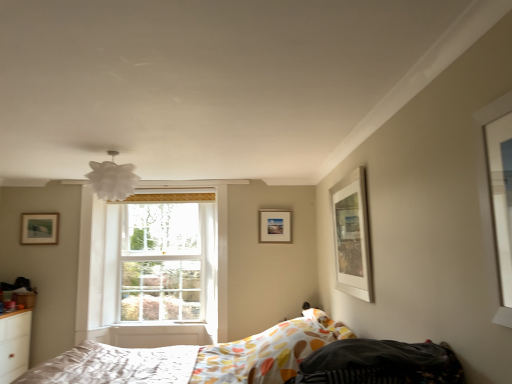
Locate an element on the screen. The image size is (512, 384). patterned fabric mattress at lower right, the second mattress from the bottom is located at coordinates (380, 363).

Where is `white matte picture frame at upper right, marked as the third picture frame in a left-to-right arrangement`? The image size is (512, 384). white matte picture frame at upper right, marked as the third picture frame in a left-to-right arrangement is located at coordinates (352, 236).

Image resolution: width=512 pixels, height=384 pixels. What do you see at coordinates (196, 358) in the screenshot? I see `patterned fabric bed at lower center` at bounding box center [196, 358].

Locate an element on the screen. patterned fabric mattress at lower right, marked as the first mattress in a right-to-left arrangement is located at coordinates (380, 363).

I want to click on the 1st picture frame above the white matte picture frame at upper right, marked as the third picture frame in a left-to-right arrangement (from a real-world perspective), so click(275, 226).

What's the angular difference between wooden picture frame at center, arranged as the 1th picture frame when viewed from the back, and white matte picture frame at upper right, arranged as the 1th picture frame when viewed from the right,'s facing directions?

The angular difference between wooden picture frame at center, arranged as the 1th picture frame when viewed from the back, and white matte picture frame at upper right, arranged as the 1th picture frame when viewed from the right, is 89.8 degrees.

In the scene shown: Considering the sizes of objects wooden picture frame at center, the second picture frame in the right-to-left sequence, and white matte picture frame at upper right, which is counted as the 1th picture frame, starting from the front, in the image provided, who is taller, wooden picture frame at center, the second picture frame in the right-to-left sequence, or white matte picture frame at upper right, which is counted as the 1th picture frame, starting from the front,?

With more height is white matte picture frame at upper right, which is counted as the 1th picture frame, starting from the front.

Would you say patterned fabric mattress at lower right, which is the second mattress from back to front, is part of wooden picture frame at upper left, the 1th picture frame when ordered from left to right,'s contents?

No, wooden picture frame at upper left, the 1th picture frame when ordered from left to right, does not contain patterned fabric mattress at lower right, which is the second mattress from back to front.

In the scene shown: Is wooden picture frame at upper left, marked as the 2th picture frame in a back-to-front arrangement, next to patterned fabric mattress at lower right, marked as the first mattress in a right-to-left arrangement, and touching it?

No, wooden picture frame at upper left, marked as the 2th picture frame in a back-to-front arrangement, is not with patterned fabric mattress at lower right, marked as the first mattress in a right-to-left arrangement.

Considering the positions of objects wooden picture frame at upper left, the 1th picture frame when ordered from left to right, and patterned fabric mattress at lower right, the second mattress from the bottom, in the image provided, who is more to the right, wooden picture frame at upper left, the 1th picture frame when ordered from left to right, or patterned fabric mattress at lower right, the second mattress from the bottom,?

patterned fabric mattress at lower right, the second mattress from the bottom.

What's the angular difference between wooden picture frame at upper left, marked as the 2th picture frame in a back-to-front arrangement, and patterned fabric mattress at lower right, which is the first mattress in top-to-bottom order,'s facing directions?

89.1 degrees separate the facing orientations of wooden picture frame at upper left, marked as the 2th picture frame in a back-to-front arrangement, and patterned fabric mattress at lower right, which is the first mattress in top-to-bottom order.

Is patterned fabric mattress at lower right, marked as the first mattress in a right-to-left arrangement, bigger than patterned fabric bed at lower center?

No.

How far apart are patterned fabric mattress at lower right, which is counted as the first mattress, starting from the front, and patterned fabric bed at lower center?

patterned fabric mattress at lower right, which is counted as the first mattress, starting from the front, and patterned fabric bed at lower center are 4.52 feet apart.

How different are the orientations of patterned fabric mattress at lower right, which is the first mattress in top-to-bottom order, and patterned fabric bed at lower center in degrees?

0.000103 degrees separate the facing orientations of patterned fabric mattress at lower right, which is the first mattress in top-to-bottom order, and patterned fabric bed at lower center.

Is patterned fabric mattress at lower right, which is counted as the first mattress, starting from the front, aimed at patterned fabric bed at lower center?

No, patterned fabric mattress at lower right, which is counted as the first mattress, starting from the front, is not facing towards patterned fabric bed at lower center.

Can you tell me how much patterned fabric bed at lower center and white matte picture frame at upper right, arranged as the 1th picture frame when viewed from the right, differ in facing direction?

There is a 0.714-degree angle between the facing directions of patterned fabric bed at lower center and white matte picture frame at upper right, arranged as the 1th picture frame when viewed from the right.

From the picture: Is patterned fabric bed at lower center in front of white matte picture frame at upper right, which appears as the 3th picture frame when viewed from the back?

That is True.

Can you confirm if patterned fabric bed at lower center is smaller than white matte picture frame at upper right, which appears as the 3th picture frame when viewed from the back?

No.

From the image's perspective, which is below, patterned fabric bed at lower center or wooden picture frame at upper left, arranged as the 2th picture frame when viewed from the front?

patterned fabric bed at lower center appears lower in the image.

Is patterned fabric bed at lower center far away from wooden picture frame at upper left, arranged as the 2th picture frame when viewed from the front?

Yes.

From a real-world perspective, between patterned fabric bed at lower center and wooden picture frame at upper left, which is the 3th picture frame in right-to-left order, who is vertically higher?

wooden picture frame at upper left, which is the 3th picture frame in right-to-left order, is physically above.

In the scene shown: Is patterned fabric bed at lower center oriented towards wooden picture frame at upper left, arranged as the 2th picture frame when viewed from the front?

No, patterned fabric bed at lower center is not facing towards wooden picture frame at upper left, arranged as the 2th picture frame when viewed from the front.

Is wooden picture frame at center, the second picture frame in the right-to-left sequence, with patterned fabric bed at lower center?

wooden picture frame at center, the second picture frame in the right-to-left sequence, is not next to patterned fabric bed at lower center, and they're not touching.

Is point (280, 217) more distant than point (153, 375)?

Yes, point (280, 217) is farther from viewer.

Is wooden picture frame at center, the second picture frame in the right-to-left sequence, to the left of patterned fabric bed at lower center from the viewer's perspective?

No.

Between wooden picture frame at center, arranged as the 1th picture frame when viewed from the back, and patterned fabric bed at lower center, which one is positioned in front?

Positioned in front is patterned fabric bed at lower center.

Which point is more distant from viewer, [89,176] or [393,347]?

Point [89,176]

Which of these two, white paper lampshade at upper center or patterned fabric mattress at lower right, marked as the first mattress in a right-to-left arrangement, is thinner?

With smaller width is white paper lampshade at upper center.

Is white paper lampshade at upper center positioned far away from patterned fabric mattress at lower right, which is the second mattress from back to front?

Yes, white paper lampshade at upper center and patterned fabric mattress at lower right, which is the second mattress from back to front, are quite far apart.

Is white paper lampshade at upper center turned away from patterned fabric mattress at lower right, marked as the first mattress in a right-to-left arrangement?

white paper lampshade at upper center is not turned away from patterned fabric mattress at lower right, marked as the first mattress in a right-to-left arrangement.

From a real-world perspective, which picture frame is the 1st one above the white matte picture frame at upper right, which appears as the 3th picture frame when viewed from the back? Please provide its 2D coordinates.

[(275, 226)]

Starting from the patterned fabric mattress at lower right, marked as the first mattress in a right-to-left arrangement, which picture frame is the 2nd one to the left? Please provide its 2D coordinates.

[(39, 228)]

Which object lies further to the anchor point clear glass window at center, wooden picture frame at center, the second picture frame in the right-to-left sequence, or patterned fabric mattress at lower right, marked as the first mattress in a right-to-left arrangement?

Based on the image, patterned fabric mattress at lower right, marked as the first mattress in a right-to-left arrangement, appears to be further to clear glass window at center.

From the image, which object appears to be nearer to wooden picture frame at upper left, the 1th picture frame when ordered from left to right, white paper lampshade at upper center or white fabric mattress at lower left, acting as the second mattress starting from the right?

white paper lampshade at upper center is positioned closer to the anchor wooden picture frame at upper left, the 1th picture frame when ordered from left to right.

Which object lies further to the anchor point wooden picture frame at center, arranged as the 1th picture frame when viewed from the back, wooden picture frame at upper left, the 1th picture frame when ordered from left to right, or patterned fabric bed at lower center?

wooden picture frame at upper left, the 1th picture frame when ordered from left to right, is positioned further to the anchor wooden picture frame at center, arranged as the 1th picture frame when viewed from the back.

When comparing their distances from clear glass window at center, does patterned fabric mattress at lower right, which is the first mattress in top-to-bottom order, or wooden picture frame at center, the 3th picture frame in the front-to-back sequence, seem further?

patterned fabric mattress at lower right, which is the first mattress in top-to-bottom order, is further to clear glass window at center.

Considering their positions, is clear glass window at center positioned closer to patterned fabric bed at lower center than patterned fabric mattress at lower right, the second mattress from the bottom?

Among the two, clear glass window at center is located nearer to patterned fabric bed at lower center.

Considering their positions, is white fabric mattress at lower left, arranged as the first mattress when ordered from the bottom, positioned further to wooden picture frame at upper left, the 1th picture frame when ordered from left to right, than patterned fabric mattress at lower right, marked as the first mattress in a right-to-left arrangement?

patterned fabric mattress at lower right, marked as the first mattress in a right-to-left arrangement, is positioned further to the anchor wooden picture frame at upper left, the 1th picture frame when ordered from left to right.

Based on their spatial positions, is white matte picture frame at upper right, arranged as the 1th picture frame when viewed from the right, or white paper lampshade at upper center further from wooden picture frame at upper left, the 1th picture frame when ordered from left to right?

white matte picture frame at upper right, arranged as the 1th picture frame when viewed from the right, is further to wooden picture frame at upper left, the 1th picture frame when ordered from left to right.

Estimate the real-world distances between objects in this image. Which object is closer to white paper lampshade at upper center, patterned fabric bed at lower center or patterned fabric mattress at lower right, the second mattress positioned from the left?

patterned fabric bed at lower center lies closer to white paper lampshade at upper center than the other object.

The image size is (512, 384). Identify the location of mattress located between patterned fabric mattress at lower right, which is the first mattress in top-to-bottom order, and clear glass window at center in the depth direction. (115, 366).

This screenshot has height=384, width=512. In order to click on bed between patterned fabric mattress at lower right, the second mattress from the bottom, and white paper lampshade at upper center in the front-back direction in this screenshot , I will do `click(196, 358)`.

Where is `bed that lies between white paper lampshade at upper center and white fabric mattress at lower left, which ranks as the 1th mattress in left-to-right order, from top to bottom`? This screenshot has height=384, width=512. bed that lies between white paper lampshade at upper center and white fabric mattress at lower left, which ranks as the 1th mattress in left-to-right order, from top to bottom is located at coordinates (196, 358).

At what (x,y) coordinates should I click in order to perform the action: click on lamp between patterned fabric mattress at lower right, the second mattress from the bottom, and clear glass window at center from front to back. Please return your answer as a coordinate pair (x, y). Image resolution: width=512 pixels, height=384 pixels. Looking at the image, I should click on (112, 179).